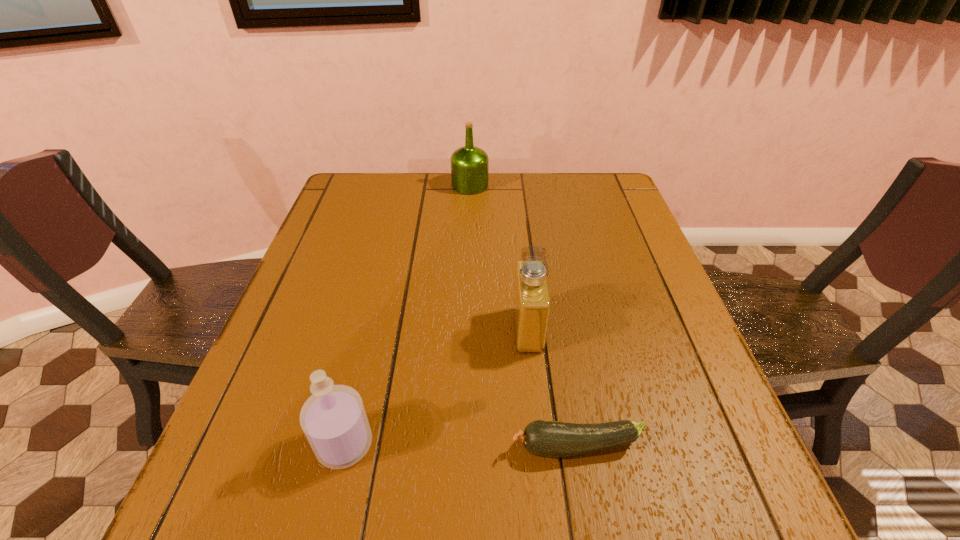
Identify which object is located as the third nearest to the left perfume. Please provide its 2D coordinates. Your answer should be formatted as a tuple, i.e. [(x, y)], where the tuple contains the x and y coordinates of a point satisfying the conditions above.

[(469, 165)]

Image resolution: width=960 pixels, height=540 pixels. I want to click on free space that satisfies the following two spatial constraints: 1. on the back side of the leftmost object; 2. on the left side of the farthest object, so click(x=407, y=186).